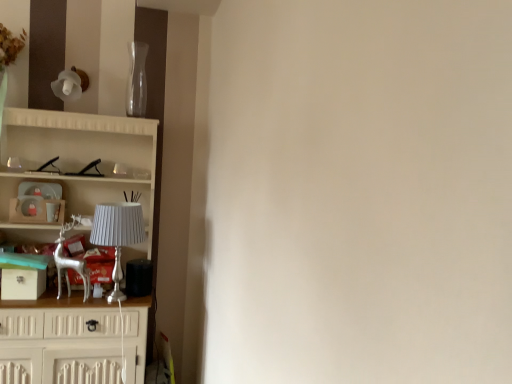
This screenshot has width=512, height=384. What do you see at coordinates (70, 259) in the screenshot?
I see `silver metallic deer at left` at bounding box center [70, 259].

The width and height of the screenshot is (512, 384). In order to click on silver metallic lamp at left in this screenshot , I will do `click(117, 235)`.

Is silver metallic deer at left to the left of silver metallic lamp at left from the viewer's perspective?

Yes, silver metallic deer at left is to the left of silver metallic lamp at left.

This screenshot has height=384, width=512. Find the location of `lamp above the silver metallic deer at left (from a real-world perspective)`. lamp above the silver metallic deer at left (from a real-world perspective) is located at coordinates (117, 235).

Would you say silver metallic deer at left is inside or outside silver metallic lamp at left?

silver metallic deer at left is spatially situated outside silver metallic lamp at left.

From a real-world perspective, which is physically above, silver metallic deer at left or silver metallic lamp at left?

From a 3D spatial view, silver metallic lamp at left is above.

Does transparent glass vase at upper center turn towards silver metallic lamp at left?

No, transparent glass vase at upper center is not turned towards silver metallic lamp at left.

Locate an element on the screen. glass vase positioned vertically above the silver metallic lamp at left (from a real-world perspective) is located at coordinates (137, 80).

Can you confirm if transparent glass vase at upper center is smaller than silver metallic lamp at left?

Yes, transparent glass vase at upper center is smaller than silver metallic lamp at left.

How far apart are transparent glass vase at upper center and silver metallic lamp at left?

transparent glass vase at upper center is 29.94 inches away from silver metallic lamp at left.

How much distance is there between white wooden cupboard at left and transparent glass vase at upper center?

A distance of 40.81 centimeters exists between white wooden cupboard at left and transparent glass vase at upper center.

Is transparent glass vase at upper center a part of white wooden cupboard at left?

No, transparent glass vase at upper center is not surrounded by white wooden cupboard at left.

Considering the sizes of white wooden cupboard at left and transparent glass vase at upper center in the image, is white wooden cupboard at left taller or shorter than transparent glass vase at upper center?

Considering their sizes, white wooden cupboard at left has more height than transparent glass vase at upper center.

Is white wooden cupboard at left thinner than transparent glass vase at upper center?

In fact, white wooden cupboard at left might be wider than transparent glass vase at upper center.

Which is behind, point (72, 180) or point (114, 284)?

The point (72, 180) is behind.

Is white wooden cupboard at left to the left or to the right of silver metallic lamp at left in the image?

From the image, it's evident that white wooden cupboard at left is to the left of silver metallic lamp at left.

Is white wooden cupboard at left facing towards silver metallic lamp at left?

Yes, white wooden cupboard at left is oriented towards silver metallic lamp at left.

Is white wooden cupboard at left next to silver metallic lamp at left and touching it?

No, white wooden cupboard at left is not making contact with silver metallic lamp at left.

In the image, is transparent glass vase at upper center positioned in front of or behind silver metallic deer at left?

transparent glass vase at upper center is positioned farther from the viewer than silver metallic deer at left.

Locate an element on the screen. This screenshot has width=512, height=384. swivel chair below the transparent glass vase at upper center (from a real-world perspective) is located at coordinates (70, 259).

Looking at this image, who is smaller, transparent glass vase at upper center or silver metallic deer at left?

transparent glass vase at upper center.

Considering the positions of points (132, 65) and (83, 277), is point (132, 65) farther from camera compared to point (83, 277)?

Yes, it is behind point (83, 277).

In the scene shown: From a real-world perspective, is white wooden cupboard at left positioned above or below silver metallic deer at left?

white wooden cupboard at left is situated lower than silver metallic deer at left in the real world.

Considering the positions of objects white wooden cupboard at left and silver metallic deer at left in the image provided, who is more to the left, white wooden cupboard at left or silver metallic deer at left?

Positioned to the left is white wooden cupboard at left.

From the image's perspective, is white wooden cupboard at left under silver metallic deer at left?

Yes.

Who is smaller, white wooden cupboard at left or silver metallic deer at left?

With smaller size is silver metallic deer at left.

Considering the relative sizes of silver metallic lamp at left and silver metallic deer at left in the image provided, is silver metallic lamp at left smaller than silver metallic deer at left?

Actually, silver metallic lamp at left might be larger than silver metallic deer at left.

Is point (137, 208) positioned before point (77, 265)?

Yes, it is.

Can you tell me how much silver metallic lamp at left and silver metallic deer at left differ in facing direction?

The angle between the facing direction of silver metallic lamp at left and the facing direction of silver metallic deer at left is 1.3 degrees.

Between silver metallic lamp at left and silver metallic deer at left, which one is positioned in front?

silver metallic lamp at left is closer to the camera.

Image resolution: width=512 pixels, height=384 pixels. There is a silver metallic deer at left. In order to click on lamp above it (from a real-world perspective) in this screenshot , I will do `click(117, 235)`.

The width and height of the screenshot is (512, 384). What are the coordinates of `lamp beneath the transparent glass vase at upper center (from a real-world perspective)` in the screenshot? It's located at (117, 235).

Estimate the real-world distances between objects in this image. Which object is closer to silver metallic deer at left, white wooden cupboard at left or transparent glass vase at upper center?

Based on the image, white wooden cupboard at left appears to be nearer to silver metallic deer at left.

Estimate the real-world distances between objects in this image. Which object is closer to silver metallic deer at left, white wooden cupboard at left or silver metallic lamp at left?

silver metallic lamp at left is positioned closer to the anchor silver metallic deer at left.

Which object lies nearer to the anchor point white wooden cupboard at left, transparent glass vase at upper center or silver metallic deer at left?

silver metallic deer at left is positioned closer to the anchor white wooden cupboard at left.

When comparing their distances from silver metallic deer at left, does silver metallic lamp at left or white wooden cupboard at left seem closer?

silver metallic lamp at left is positioned closer to the anchor silver metallic deer at left.

Based on their spatial positions, is white wooden cupboard at left or silver metallic deer at left closer to transparent glass vase at upper center?

Based on the image, white wooden cupboard at left appears to be nearer to transparent glass vase at upper center.

Which object lies nearer to the anchor point silver metallic lamp at left, white wooden cupboard at left or transparent glass vase at upper center?

white wooden cupboard at left is positioned closer to the anchor silver metallic lamp at left.

From the picture: When comparing their distances from transparent glass vase at upper center, does white wooden cupboard at left or silver metallic lamp at left seem closer?

white wooden cupboard at left is positioned closer to the anchor transparent glass vase at upper center.

Based on their spatial positions, is silver metallic deer at left or silver metallic lamp at left closer to white wooden cupboard at left?

silver metallic deer at left.

I want to click on lamp that lies between transparent glass vase at upper center and silver metallic deer at left from top to bottom, so click(x=117, y=235).

I want to click on swivel chair between transparent glass vase at upper center and white wooden cupboard at left in the vertical direction, so (x=70, y=259).

This screenshot has height=384, width=512. In order to click on swivel chair between white wooden cupboard at left and silver metallic lamp at left from left to right in this screenshot , I will do `click(70, 259)`.

Locate an element on the screen. Image resolution: width=512 pixels, height=384 pixels. lamp between transparent glass vase at upper center and white wooden cupboard at left from top to bottom is located at coordinates (117, 235).